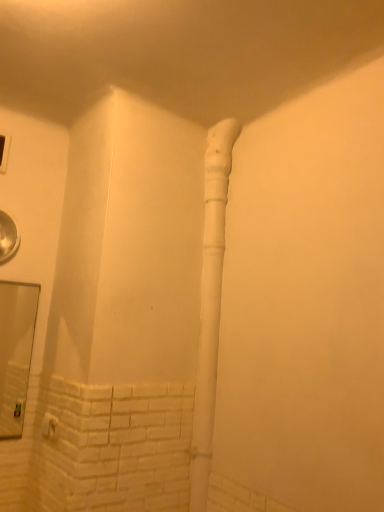
Question: Is there a large distance between clear glass mirror at lower left and white matte water pipe at center?

Choices:
 (A) no
 (B) yes

Answer: (B)

Question: Is clear glass mirror at lower left wider than white matte water pipe at center?

Choices:
 (A) no
 (B) yes

Answer: (A)

Question: Does clear glass mirror at lower left have a larger size compared to white matte water pipe at center?

Choices:
 (A) no
 (B) yes

Answer: (A)

Question: Is clear glass mirror at lower left in front of white matte water pipe at center?

Choices:
 (A) no
 (B) yes

Answer: (A)

Question: Is clear glass mirror at lower left thinner than white matte water pipe at center?

Choices:
 (A) no
 (B) yes

Answer: (B)

Question: Is white matte water pipe at center located within clear glass mirror at lower left?

Choices:
 (A) yes
 (B) no

Answer: (B)

Question: Can you confirm if white matte water pipe at center is wider than clear glass mirror at lower left?

Choices:
 (A) no
 (B) yes

Answer: (B)

Question: From the image's perspective, does white matte water pipe at center appear higher than clear glass mirror at lower left?

Choices:
 (A) yes
 (B) no

Answer: (A)

Question: Would you say white matte water pipe at center contains clear glass mirror at lower left?

Choices:
 (A) yes
 (B) no

Answer: (B)

Question: From a real-world perspective, is white matte water pipe at center positioned under clear glass mirror at lower left based on gravity?

Choices:
 (A) no
 (B) yes

Answer: (A)

Question: Considering the relative positions of white matte water pipe at center and clear glass mirror at lower left in the image provided, is white matte water pipe at center behind clear glass mirror at lower left?

Choices:
 (A) yes
 (B) no

Answer: (B)

Question: Is white matte water pipe at center positioned with its back to clear glass mirror at lower left?

Choices:
 (A) no
 (B) yes

Answer: (A)

Question: In terms of size, does clear glass mirror at lower left appear bigger or smaller than white matte water pipe at center?

Choices:
 (A) big
 (B) small

Answer: (B)